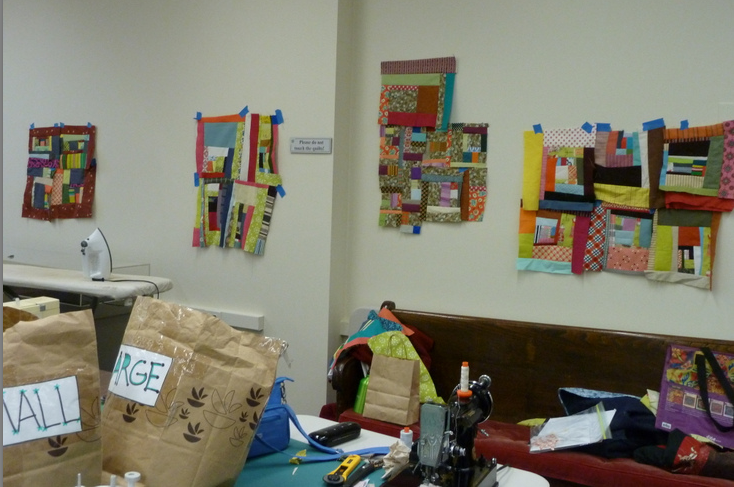
Locate an element on the screen. white wall is located at coordinates (536, 78).